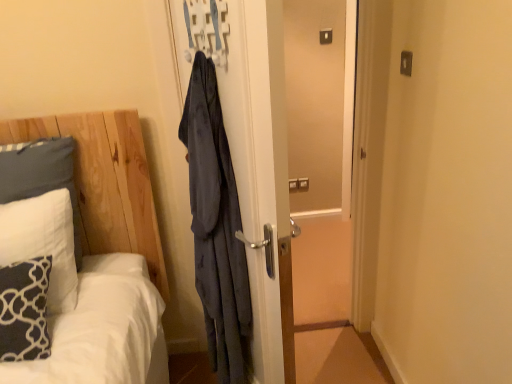
Describe the element at coordinates (42, 242) in the screenshot. The width and height of the screenshot is (512, 384). I see `white soft pillow at left, positioned as the second pillow in front-to-back order` at that location.

The image size is (512, 384). What are the coordinates of `matte blue fabric hanger at upper center` in the screenshot? It's located at (206, 29).

In the scene shown: What is the approximate width of white soft pillow at left, positioned as the 1th pillow in back-to-front order?

white soft pillow at left, positioned as the 1th pillow in back-to-front order, is 20.21 centimeters wide.

Where is `dark blue textured pillow at lower left, which ranks as the 3th pillow in back-to-front order`? Image resolution: width=512 pixels, height=384 pixels. dark blue textured pillow at lower left, which ranks as the 3th pillow in back-to-front order is located at coordinates click(24, 310).

The width and height of the screenshot is (512, 384). Describe the element at coordinates (24, 310) in the screenshot. I see `dark blue textured pillow at lower left, which is the 1th pillow in front-to-back order` at that location.

Where is `white soft pillow at left, positioned as the second pillow in front-to-back order`? The image size is (512, 384). white soft pillow at left, positioned as the second pillow in front-to-back order is located at coordinates (42, 242).

Could white soft pillow at left, positioned as the 1th pillow in back-to-front order, be considered to be inside white soft pillow at left, which is the 2th pillow in back-to-front order?

No, white soft pillow at left, which is the 2th pillow in back-to-front order, does not contain white soft pillow at left, positioned as the 1th pillow in back-to-front order.

Can you confirm if white soft pillow at left, positioned as the second pillow in front-to-back order, is shorter than white soft pillow at left, which is the third pillow from front to back?

Yes, white soft pillow at left, positioned as the second pillow in front-to-back order, is shorter than white soft pillow at left, which is the third pillow from front to back.

What's the angular difference between white soft pillow at left, positioned as the second pillow in front-to-back order, and white soft pillow at left, positioned as the 1th pillow in back-to-front order,'s facing directions?

0.000221 degrees.

From a real-world perspective, is white soft pillow at left, which is the 2th pillow in back-to-front order, over white soft pillow at left, which is the third pillow from front to back?

No, from a real-world perspective, white soft pillow at left, which is the 2th pillow in back-to-front order, is not on top of white soft pillow at left, which is the third pillow from front to back.

From the image's perspective, between matte blue fabric hanger at upper center and white soft pillow at left, positioned as the 1th pillow in back-to-front order, who is located below?

white soft pillow at left, positioned as the 1th pillow in back-to-front order, is shown below in the image.

From a real-world perspective, which is physically above, matte blue fabric hanger at upper center or white soft pillow at left, positioned as the 1th pillow in back-to-front order?

From a 3D spatial view, matte blue fabric hanger at upper center is above.

Who is bigger, matte blue fabric hanger at upper center or white soft pillow at left, positioned as the 1th pillow in back-to-front order?

With larger size is white soft pillow at left, positioned as the 1th pillow in back-to-front order.

Based on the photo, could you tell me if matte blue fabric hanger at upper center is turned towards white soft pillow at left, which is the third pillow from front to back?

No, matte blue fabric hanger at upper center is not facing towards white soft pillow at left, which is the third pillow from front to back.

Who is taller, matte blue fabric hanger at upper center or matte plastic light switch at upper center?

With more height is matte blue fabric hanger at upper center.

Is matte blue fabric hanger at upper center to the right of matte plastic light switch at upper center from the viewer's perspective?

No, matte blue fabric hanger at upper center is not to the right of matte plastic light switch at upper center.

Is matte blue fabric hanger at upper center placed right next to matte plastic light switch at upper center?

No.

Considering the sizes of objects matte blue fabric hanger at upper center and matte plastic light switch at upper center in the image provided, who is bigger, matte blue fabric hanger at upper center or matte plastic light switch at upper center?

matte blue fabric hanger at upper center.

What's the angular difference between white soft pillow at left, which is the third pillow from front to back, and dark blue textured pillow at lower left, which ranks as the 3th pillow in back-to-front order,'s facing directions?

0.577 degrees separate the facing orientations of white soft pillow at left, which is the third pillow from front to back, and dark blue textured pillow at lower left, which ranks as the 3th pillow in back-to-front order.

In terms of width, does white soft pillow at left, positioned as the 1th pillow in back-to-front order, look wider or thinner when compared to dark blue textured pillow at lower left, which is the 1th pillow in front-to-back order?

Clearly, white soft pillow at left, positioned as the 1th pillow in back-to-front order, has less width compared to dark blue textured pillow at lower left, which is the 1th pillow in front-to-back order.

From the picture: Would you say white soft pillow at left, which is the third pillow from front to back, is a long distance from dark blue textured pillow at lower left, which ranks as the 3th pillow in back-to-front order?

No, white soft pillow at left, which is the third pillow from front to back, is not far from dark blue textured pillow at lower left, which ranks as the 3th pillow in back-to-front order.

From a real-world perspective, who is located higher, white soft pillow at left, which is the third pillow from front to back, or dark blue textured pillow at lower left, which is the 1th pillow in front-to-back order?

In real-world perspective, white soft pillow at left, which is the third pillow from front to back, is above.

In the scene shown: Considering the relative sizes of dark blue textured pillow at lower left, which ranks as the 3th pillow in back-to-front order, and matte plastic light switch at upper center in the image provided, is dark blue textured pillow at lower left, which ranks as the 3th pillow in back-to-front order, bigger than matte plastic light switch at upper center?

Yes, dark blue textured pillow at lower left, which ranks as the 3th pillow in back-to-front order, is bigger than matte plastic light switch at upper center.

From the image's perspective, which object appears higher, dark blue textured pillow at lower left, which ranks as the 3th pillow in back-to-front order, or matte plastic light switch at upper center?

matte plastic light switch at upper center appears higher in the image.

Does point (18, 286) lie behind point (321, 34)?

No, (18, 286) is in front of (321, 34).

Is dark blue textured pillow at lower left, which ranks as the 3th pillow in back-to-front order, oriented towards matte plastic light switch at upper center?

No, dark blue textured pillow at lower left, which ranks as the 3th pillow in back-to-front order, is not turned towards matte plastic light switch at upper center.

Find the location of a particular element. The height and width of the screenshot is (384, 512). hanger in front of the white soft pillow at left, which is the third pillow from front to back is located at coordinates (206, 29).

Is white soft pillow at left, which is the third pillow from front to back, outside of matte blue fabric hanger at upper center?

That's correct, white soft pillow at left, which is the third pillow from front to back, is outside of matte blue fabric hanger at upper center.

Based on their sizes in the image, would you say white soft pillow at left, which is the third pillow from front to back, is bigger or smaller than matte blue fabric hanger at upper center?

Considering their sizes, white soft pillow at left, which is the third pillow from front to back, takes up more space than matte blue fabric hanger at upper center.

Considering the relative positions of white soft pillow at left, which is the third pillow from front to back, and matte blue fabric hanger at upper center in the image provided, is white soft pillow at left, which is the third pillow from front to back, behind matte blue fabric hanger at upper center?

Yes.

Which is correct: dark blue textured pillow at lower left, which ranks as the 3th pillow in back-to-front order, is inside white soft pillow at left, which is the 2th pillow in back-to-front order, or outside of it?

dark blue textured pillow at lower left, which ranks as the 3th pillow in back-to-front order, is not inside white soft pillow at left, which is the 2th pillow in back-to-front order, it's outside.

Are dark blue textured pillow at lower left, which ranks as the 3th pillow in back-to-front order, and white soft pillow at left, positioned as the second pillow in front-to-back order, located far from each other?

No.

Does dark blue textured pillow at lower left, which ranks as the 3th pillow in back-to-front order, have a greater height compared to white soft pillow at left, which is the 2th pillow in back-to-front order?

No.

Locate an element on the screen. The width and height of the screenshot is (512, 384). pillow located above the white soft pillow at left, which is the 2th pillow in back-to-front order (from a real-world perspective) is located at coordinates (41, 175).

Find the location of a particular element. hanger located on the right of white soft pillow at left, which is the third pillow from front to back is located at coordinates (206, 29).

Looking at this image, when comparing their distances from matte plastic light switch at upper center, does matte blue fabric hanger at upper center or white soft pillow at left, which is the 2th pillow in back-to-front order, seem further?

white soft pillow at left, which is the 2th pillow in back-to-front order, is positioned further to the anchor matte plastic light switch at upper center.

Which object lies nearer to the anchor point matte blue fabric hanger at upper center, matte plastic light switch at upper center or white soft pillow at left, positioned as the 1th pillow in back-to-front order?

The object closer to matte blue fabric hanger at upper center is white soft pillow at left, positioned as the 1th pillow in back-to-front order.

Based on their spatial positions, is white soft pillow at left, positioned as the 1th pillow in back-to-front order, or dark blue textured pillow at lower left, which is the 1th pillow in front-to-back order, further from white soft pillow at left, positioned as the second pillow in front-to-back order?

The object further to white soft pillow at left, positioned as the second pillow in front-to-back order, is white soft pillow at left, positioned as the 1th pillow in back-to-front order.

When comparing their distances from white soft pillow at left, which is the third pillow from front to back, does dark blue textured pillow at lower left, which is the 1th pillow in front-to-back order, or matte plastic light switch at upper center seem closer?

Based on the image, dark blue textured pillow at lower left, which is the 1th pillow in front-to-back order, appears to be nearer to white soft pillow at left, which is the third pillow from front to back.

Based on their spatial positions, is white soft pillow at left, positioned as the second pillow in front-to-back order, or matte blue fabric hanger at upper center further from dark blue textured pillow at lower left, which ranks as the 3th pillow in back-to-front order?

Based on the image, matte blue fabric hanger at upper center appears to be further to dark blue textured pillow at lower left, which ranks as the 3th pillow in back-to-front order.

When comparing their distances from white soft pillow at left, which is the 2th pillow in back-to-front order, does dark blue textured pillow at lower left, which ranks as the 3th pillow in back-to-front order, or white soft pillow at left, which is the third pillow from front to back, seem further?

Based on the image, white soft pillow at left, which is the third pillow from front to back, appears to be further to white soft pillow at left, which is the 2th pillow in back-to-front order.

Estimate the real-world distances between objects in this image. Which object is further from white soft pillow at left, positioned as the 1th pillow in back-to-front order, white soft pillow at left, positioned as the second pillow in front-to-back order, or matte plastic light switch at upper center?

Based on the image, matte plastic light switch at upper center appears to be further to white soft pillow at left, positioned as the 1th pillow in back-to-front order.

Based on their spatial positions, is white soft pillow at left, which is the 2th pillow in back-to-front order, or dark blue textured pillow at lower left, which is the 1th pillow in front-to-back order, closer to white soft pillow at left, positioned as the 1th pillow in back-to-front order?

A: Based on the image, white soft pillow at left, which is the 2th pillow in back-to-front order, appears to be nearer to white soft pillow at left, positioned as the 1th pillow in back-to-front order.

Find the location of a particular element. The width and height of the screenshot is (512, 384). pillow between white soft pillow at left, which is the third pillow from front to back, and dark blue textured pillow at lower left, which is the 1th pillow in front-to-back order, in the up-down direction is located at coordinates (42, 242).

Identify the location of pillow between white soft pillow at left, which is the 2th pillow in back-to-front order, and matte plastic light switch at upper center, along the z-axis. (41, 175).